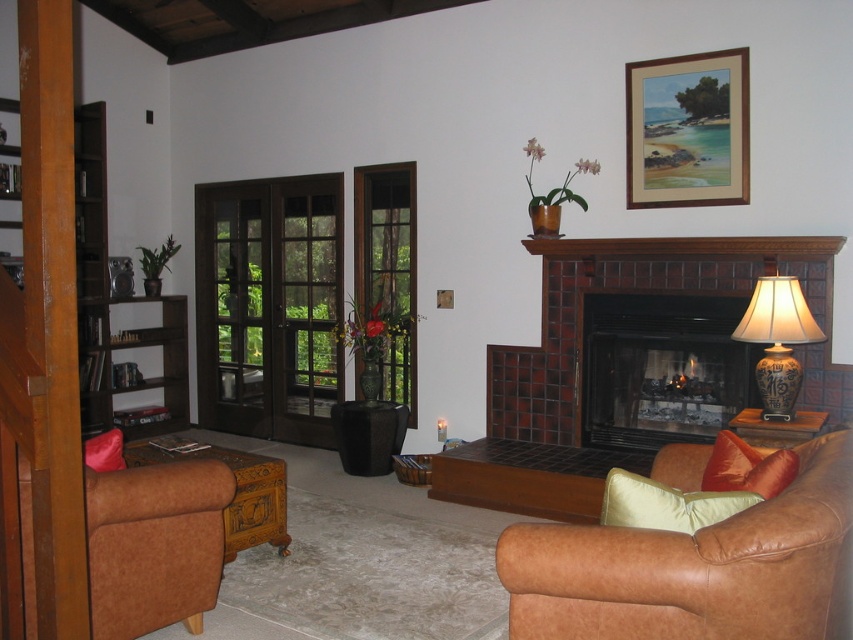
You are standing in the living room and want to move from point A to point B. Point A is at coordinate point (294, 260) and point B is at coordinate point (653, 80). Since you can only move forward, will you be able to reach point B from point A without turning?

Point (294, 260) is further to the viewer than point (653, 80). Since you can only move forward, you will not be able to reach point B from point A without turning because point B is behind point A relative to your position.